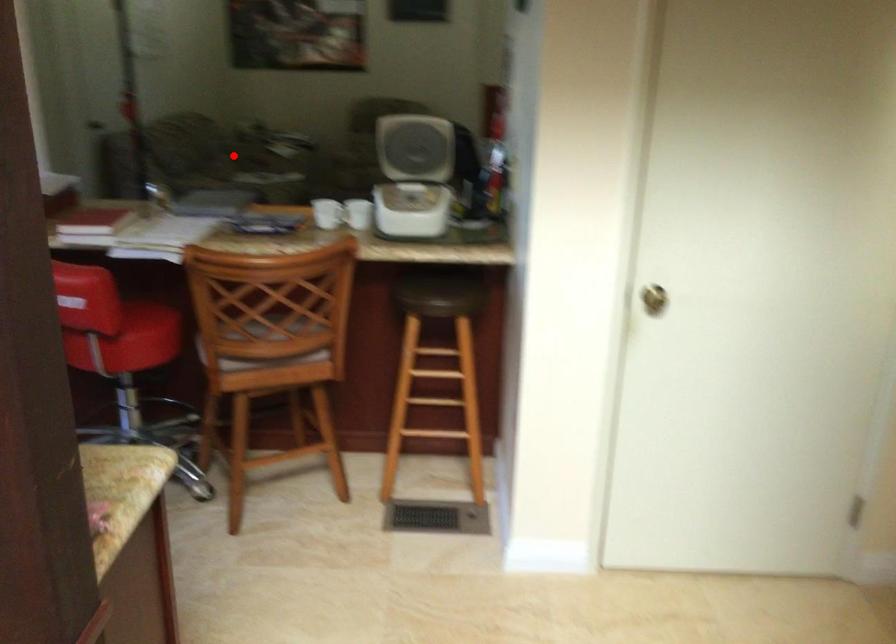
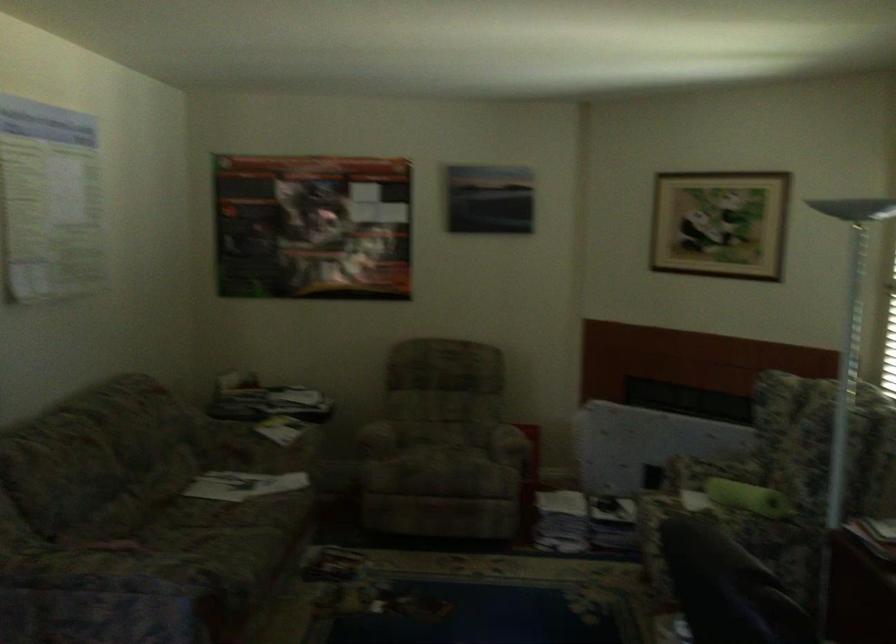
Question: I am providing you with two images of the same scene from different viewpoints. A red point is shown in image1. For the corresponding object point in image2, is it positioned nearer or farther from the camera?

Choices:
 (A) Nearer
 (B) Farther

Answer: (A)